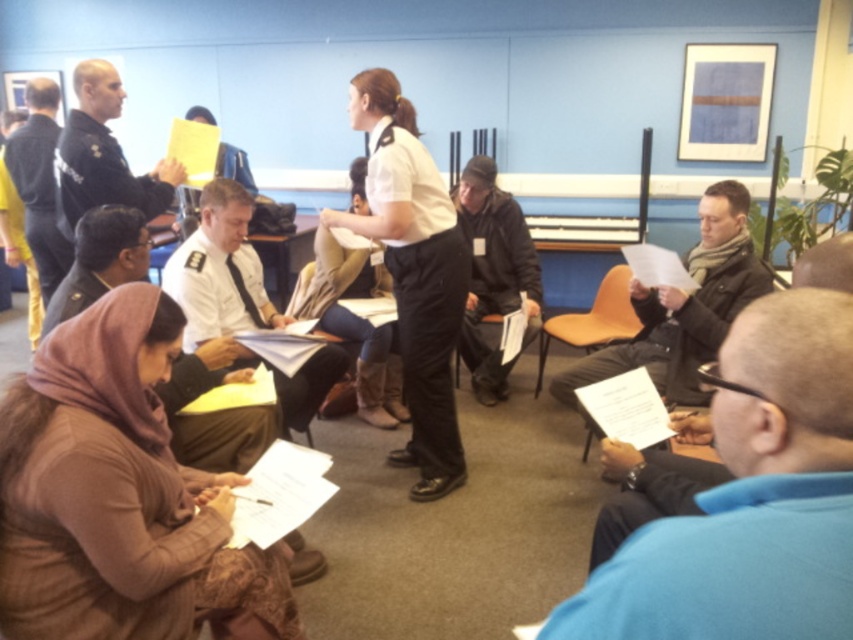
Question: Which of the following is the closest to the observer?

Choices:
 (A) (158, 493)
 (B) (479, 276)
 (C) (611, 324)

Answer: (A)

Question: Which object is closer to the camera taking this photo?

Choices:
 (A) dark blue uniform at upper left
 (B) white uniform at center

Answer: (B)

Question: Is white uniform shirt at center to the left of orange plastic chair at center from the viewer's perspective?

Choices:
 (A) yes
 (B) no

Answer: (A)

Question: Does blue fabric shirt at lower right have a greater width compared to black matte jacket at center?

Choices:
 (A) yes
 (B) no

Answer: (B)

Question: Is the position of brown textured hijab at lower left less distant than that of white uniform at center?

Choices:
 (A) no
 (B) yes

Answer: (B)

Question: Estimate the real-world distances between objects in this image. Which object is farther from the black leather jacket at center?

Choices:
 (A) orange plastic chair at center
 (B) blue fabric shirt at lower right

Answer: (B)